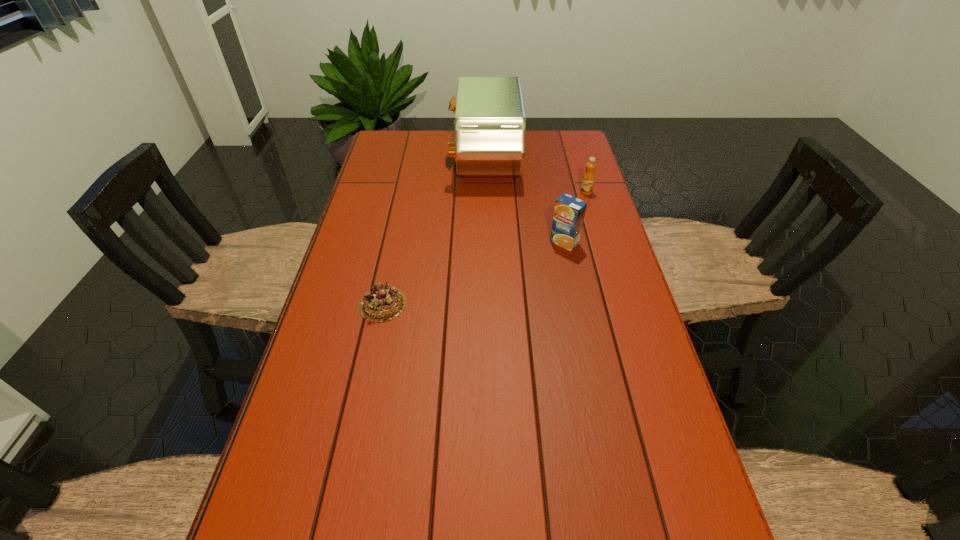
Locate an element on the screen. The image size is (960, 540). vacant area between the toaster oven and the left orange juice is located at coordinates (524, 201).

At what (x,y) coordinates should I click in order to perform the action: click on vacant region between the left orange juice and the tallest object. Please return your answer as a coordinate pair (x, y). The image size is (960, 540). Looking at the image, I should click on (524, 201).

Find the location of a particular element. free spot between the tallest object and the leftmost object is located at coordinates (434, 232).

Image resolution: width=960 pixels, height=540 pixels. Identify the location of object that can be found as the closest to the left orange juice. (588, 179).

Locate an element on the screen. This screenshot has width=960, height=540. object that is the nearest to the nearer orange juice is located at coordinates (588, 179).

Find the location of a particular element. vacant space that satisfies the following two spatial constraints: 1. on the door side of the third object from left to right; 2. on the right side of the third object from right to left is located at coordinates (486, 242).